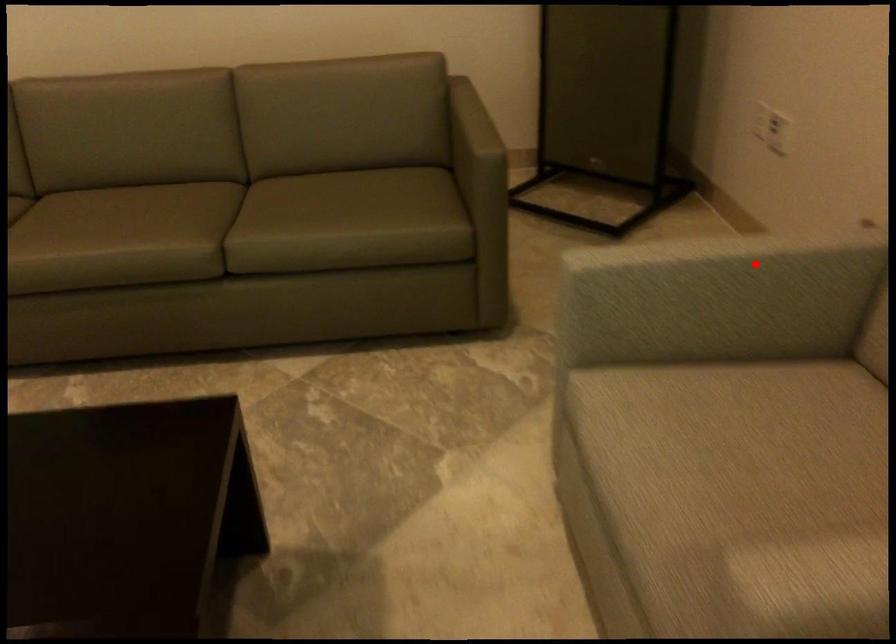
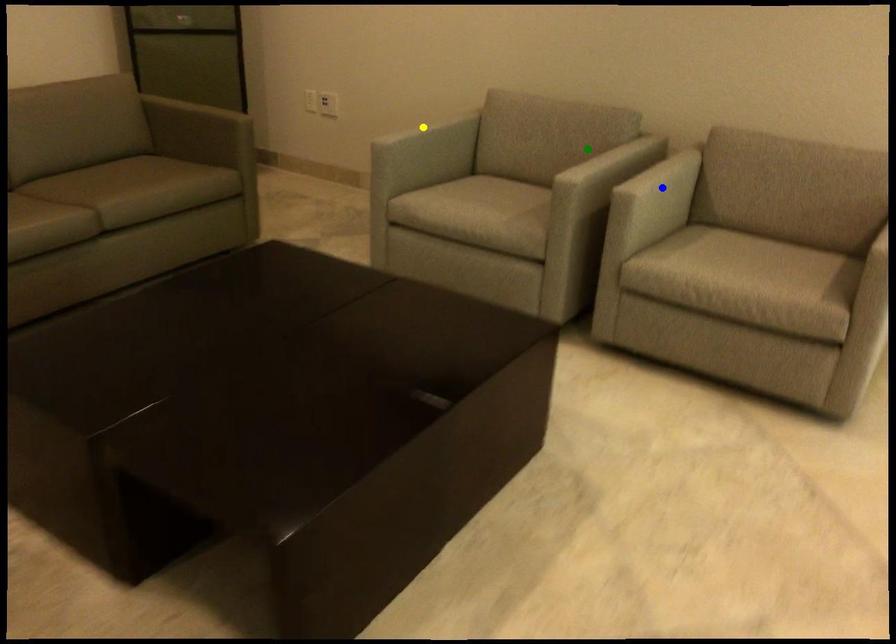
Question: I am providing you with two images of the same scene from different viewpoints. A red point is marked on the first image. You are given multiple points on the second image. In image 2, which mark is for the same physical point as the one in image 1?

Choices:
 (A) green point
 (B) blue point
 (C) yellow point

Answer: (C)